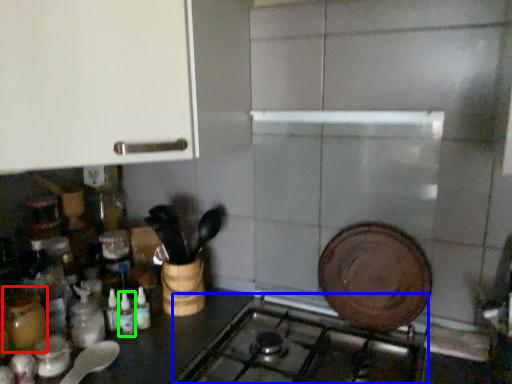
Question: Based on their relative distances, which object is farther from bottle (highlighted by a red box)? Choose from gas stove (highlighted by a blue box) and bottle (highlighted by a green box).

Choices:
 (A) gas stove
 (B) bottle

Answer: (A)